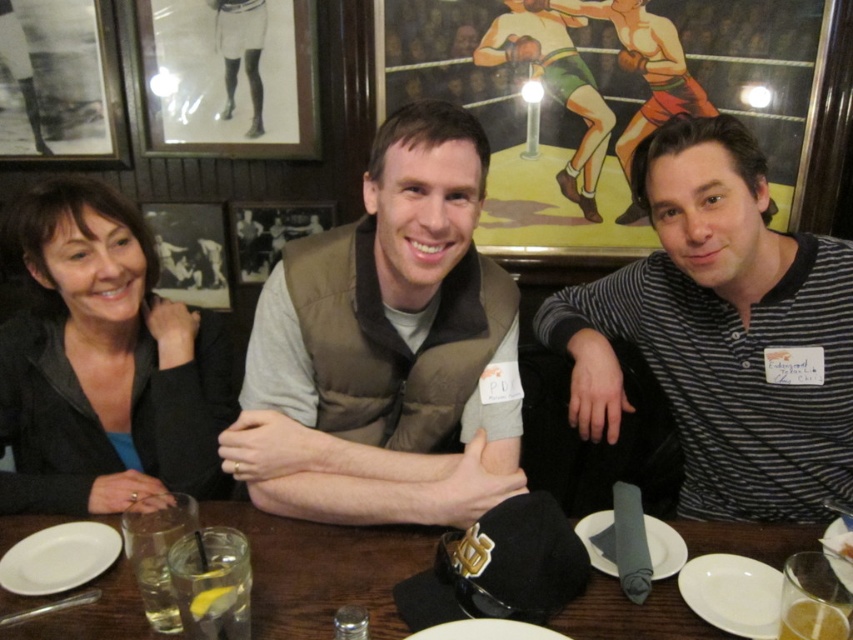
Is point (404, 632) positioned behind point (485, 60)?

No, it is in front of (485, 60).

Can you confirm if wooden table at center is positioned to the right of green fabric boxer at upper center?

Incorrect, wooden table at center is not on the right side of green fabric boxer at upper center.

The image size is (853, 640). What do you see at coordinates (323, 570) in the screenshot? I see `wooden table at center` at bounding box center [323, 570].

Image resolution: width=853 pixels, height=640 pixels. Find the location of `wooden table at center`. wooden table at center is located at coordinates (323, 570).

This screenshot has height=640, width=853. Find the location of `brown fuzzy vest at center`. brown fuzzy vest at center is located at coordinates (384, 348).

Who is shorter, brown fuzzy vest at center or matte green shorts at center?

With less height is matte green shorts at center.

Is point (323, 314) behind point (676, 100)?

No, it is not.

Where is `brown fuzzy vest at center`? brown fuzzy vest at center is located at coordinates (384, 348).

The height and width of the screenshot is (640, 853). In order to click on brown fuzzy vest at center in this screenshot , I will do `click(384, 348)`.

Find the location of a particular element. Image resolution: width=853 pixels, height=640 pixels. brown fuzzy vest at center is located at coordinates (384, 348).